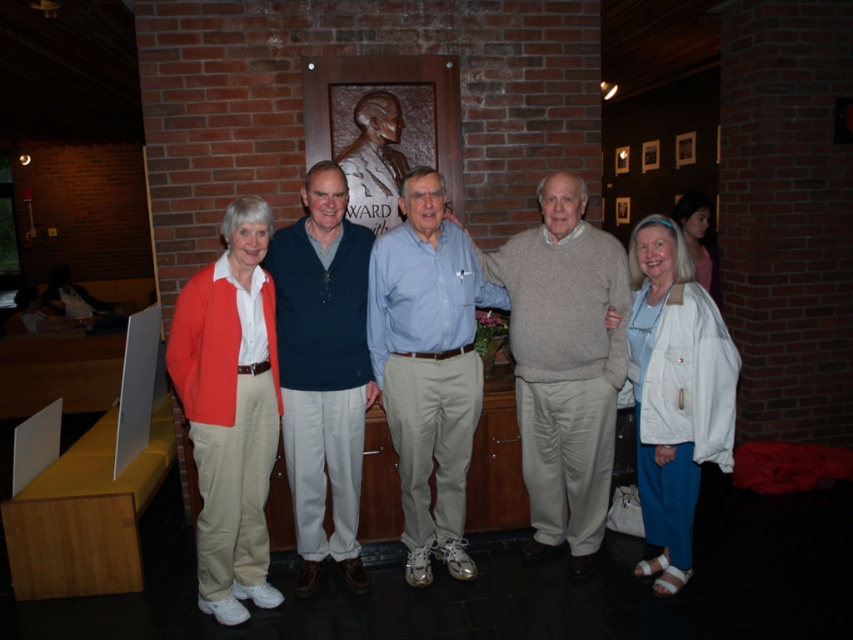
Is the position of light brown sweater at center more distant than that of light blue shirt at center?

Yes, it is.

Can you confirm if light brown sweater at center is shorter than light blue shirt at center?

Indeed, light brown sweater at center has a lesser height compared to light blue shirt at center.

Does point (531, 278) come closer to viewer compared to point (421, 545)?

Yes, it is.

The image size is (853, 640). What are the coordinates of `light brown sweater at center` in the screenshot? It's located at (564, 365).

Does light brown sweater at center appear on the right side of dark blue sweater at center?

Yes, light brown sweater at center is to the right of dark blue sweater at center.

Looking at this image, between light brown sweater at center and dark blue sweater at center, which one has less height?

light brown sweater at center

The width and height of the screenshot is (853, 640). What are the coordinates of `light brown sweater at center` in the screenshot? It's located at (564, 365).

The image size is (853, 640). Identify the location of light brown sweater at center. (564, 365).

Is the position of light brown sweater at center more distant than that of matte orange cardigan at left?

Yes, it is behind matte orange cardigan at left.

Between light brown sweater at center and matte orange cardigan at left, which one has more height?

light brown sweater at center

The image size is (853, 640). I want to click on light brown sweater at center, so click(564, 365).

At what (x,y) coordinates should I click in order to perform the action: click on light brown sweater at center. Please return your answer as a coordinate pair (x, y). Looking at the image, I should click on (564, 365).